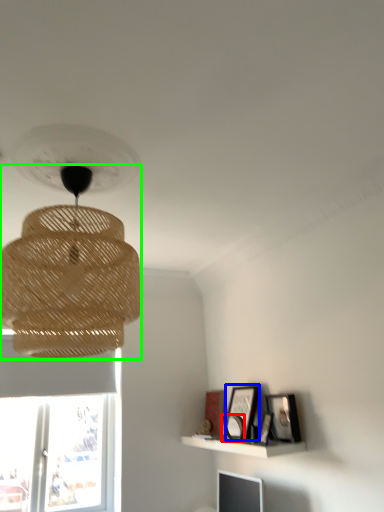
Question: Which object is the closest to the picture frame (highlighted by a red box)? Choose among these: picture frame (highlighted by a blue box) or lamp (highlighted by a green box).

Choices:
 (A) picture frame
 (B) lamp

Answer: (A)